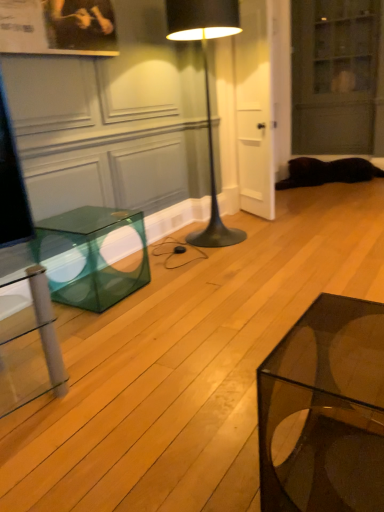
Locate an element on the screen. free spot below transparent glass coffee table at lower right (from a real-world perspective) is located at coordinates (332, 473).